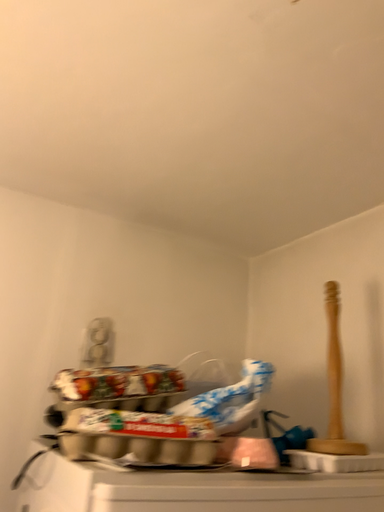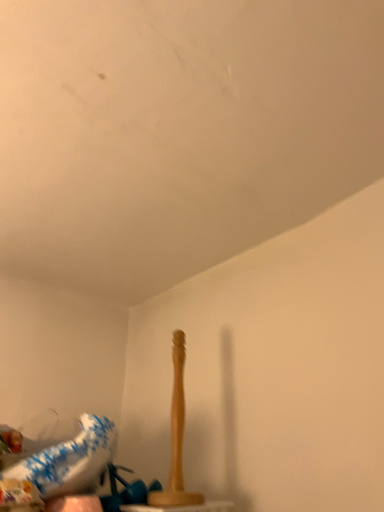
Question: Which way did the camera rotate in the video?

Choices:
 (A) rotated right
 (B) rotated left

Answer: (A)